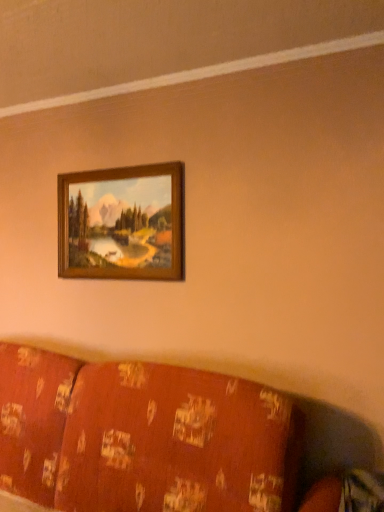
Question: Is wooden frame at upper center wider than patterned fabric couch at lower center?

Choices:
 (A) yes
 (B) no

Answer: (B)

Question: Is wooden frame at upper center turned away from patterned fabric couch at lower center?

Choices:
 (A) no
 (B) yes

Answer: (A)

Question: Can you see wooden frame at upper center touching patterned fabric couch at lower center?

Choices:
 (A) yes
 (B) no

Answer: (B)

Question: Is wooden frame at upper center at the left side of patterned fabric couch at lower center?

Choices:
 (A) yes
 (B) no

Answer: (B)

Question: Would you say wooden frame at upper center contains patterned fabric couch at lower center?

Choices:
 (A) no
 (B) yes

Answer: (A)

Question: From a real-world perspective, is wooden frame at upper center positioned over patterned fabric couch at lower center based on gravity?

Choices:
 (A) yes
 (B) no

Answer: (A)

Question: Does patterned fabric couch at lower center have a lesser height compared to wooden frame at upper center?

Choices:
 (A) yes
 (B) no

Answer: (B)

Question: Would you say patterned fabric couch at lower center is a long distance from wooden frame at upper center?

Choices:
 (A) no
 (B) yes

Answer: (A)

Question: Does patterned fabric couch at lower center come in front of wooden frame at upper center?

Choices:
 (A) no
 (B) yes

Answer: (B)

Question: From a real-world perspective, does patterned fabric couch at lower center sit lower than wooden frame at upper center?

Choices:
 (A) yes
 (B) no

Answer: (A)

Question: Does patterned fabric couch at lower center turn towards wooden frame at upper center?

Choices:
 (A) no
 (B) yes

Answer: (A)

Question: Is patterned fabric couch at lower center not inside wooden frame at upper center?

Choices:
 (A) no
 (B) yes

Answer: (B)

Question: From the image's perspective, is patterned fabric couch at lower center above or below wooden frame at upper center?

Choices:
 (A) below
 (B) above

Answer: (A)